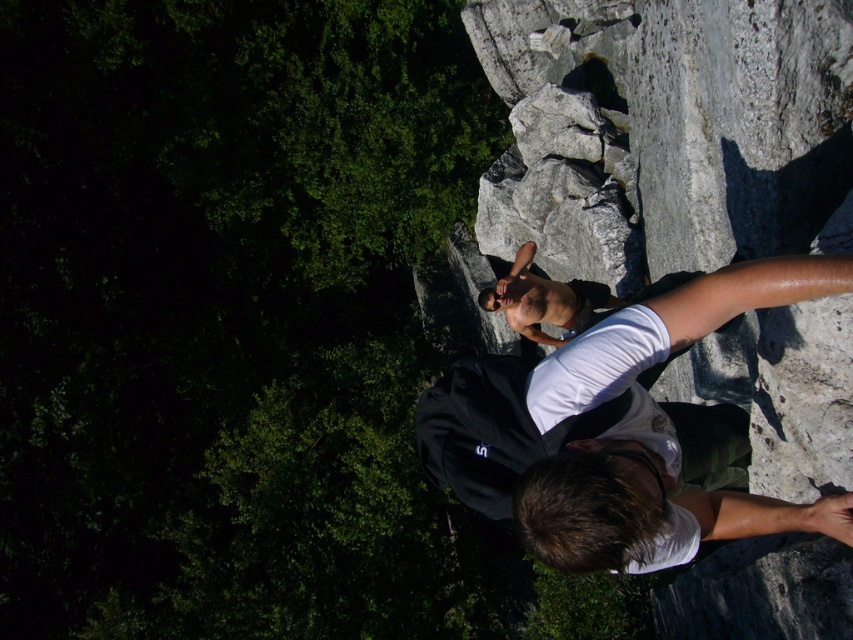
Question: Which point appears closest to the camera in this image?

Choices:
 (A) (460, 458)
 (B) (508, 278)

Answer: (A)

Question: Among these points, which one is nearest to the camera?

Choices:
 (A) (589, 308)
 (B) (838, 524)

Answer: (B)

Question: In this image, where is shiny black shirt at center located relative to shiny skin torso at center?

Choices:
 (A) above
 (B) below

Answer: (B)

Question: Does shiny black shirt at center have a lesser width compared to shiny skin torso at center?

Choices:
 (A) yes
 (B) no

Answer: (B)

Question: Can you confirm if shiny black shirt at center is thinner than shiny skin torso at center?

Choices:
 (A) yes
 (B) no

Answer: (B)